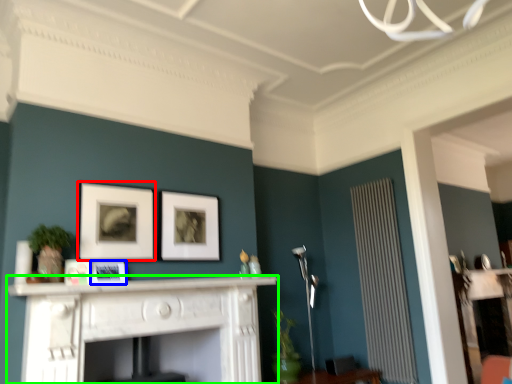
Question: Which object is positioned farthest from picture frame (highlighted by a red box)? Select from picture frame (highlighted by a blue box) and fireplace (highlighted by a green box).

Choices:
 (A) picture frame
 (B) fireplace

Answer: (B)